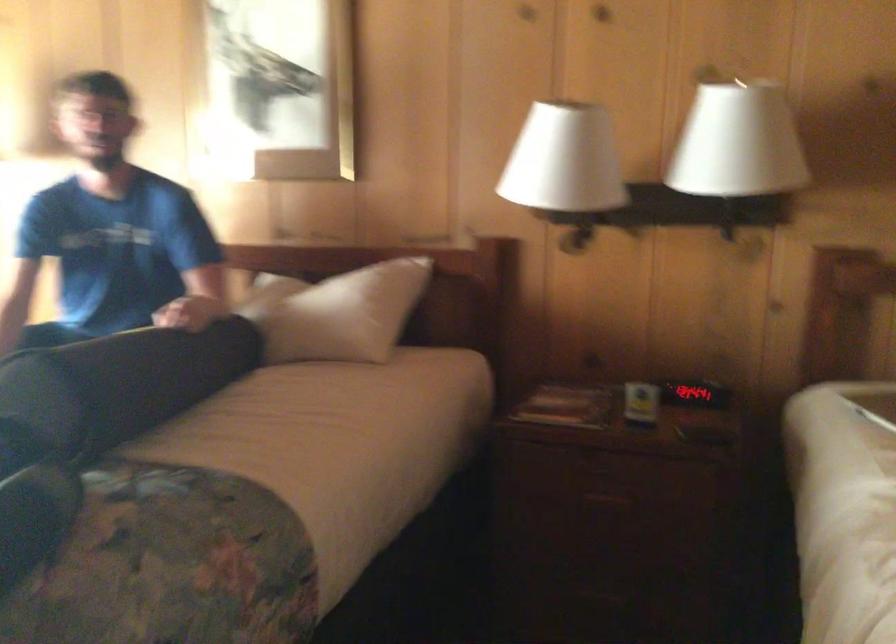
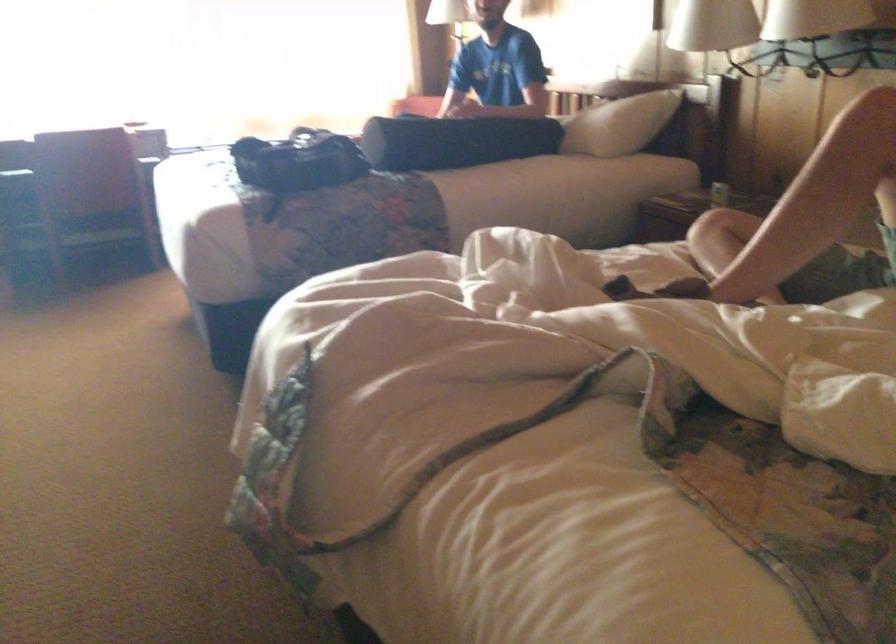
Where in the second image is the point corresponding to pixel 199 386 from the first image?

(454, 140)